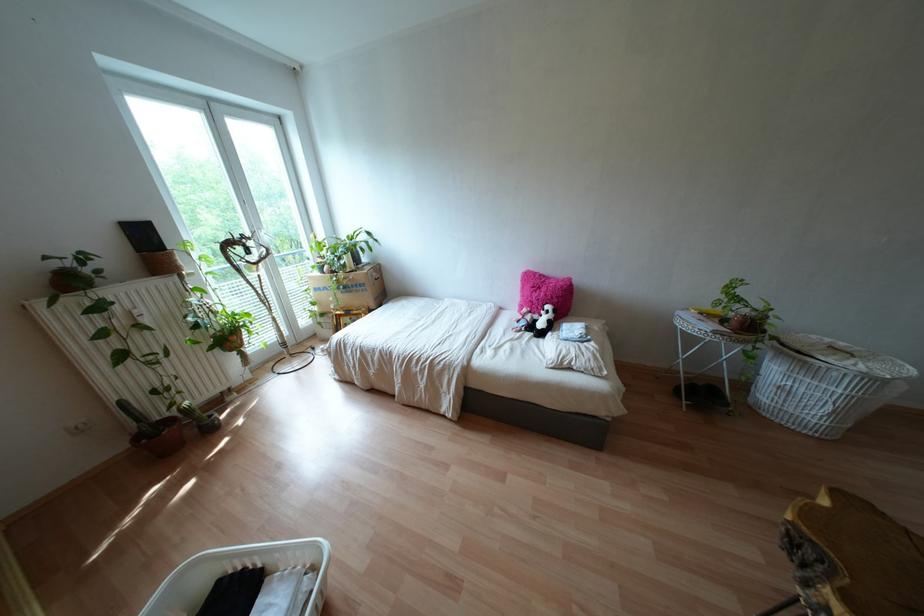
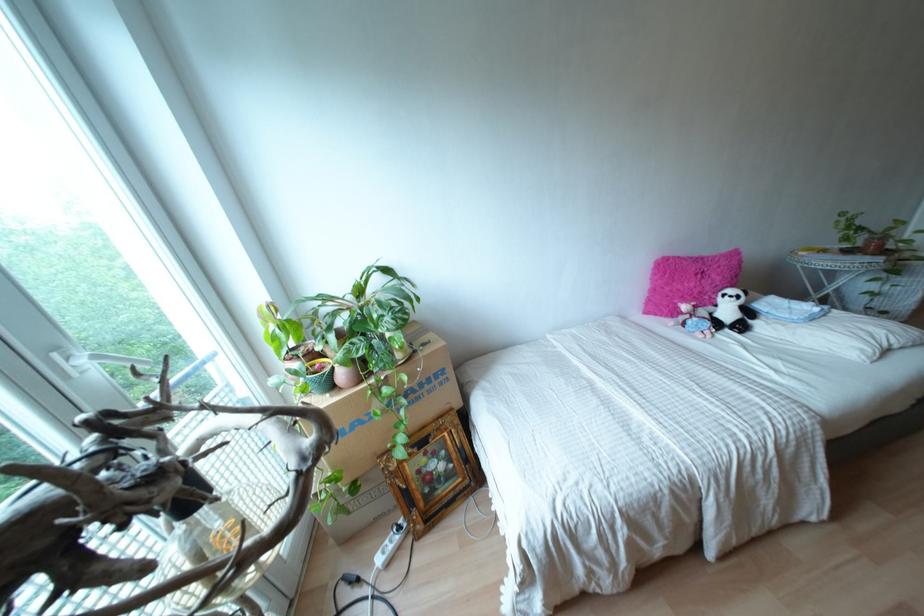
Find the pixel in the second image that matches point (535, 315) in the first image.

(710, 308)